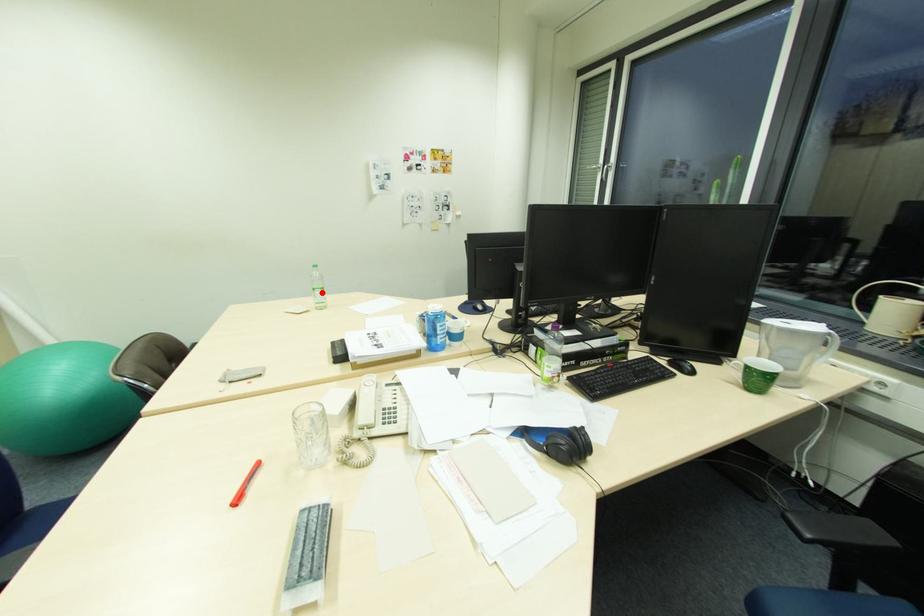
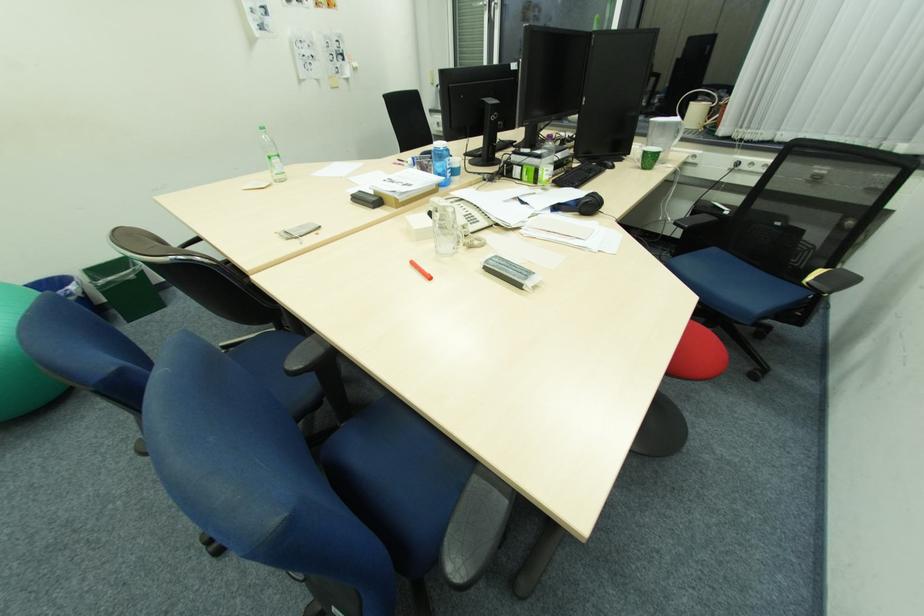
Question: I am providing you with two images of the same scene from different viewpoints. A red point is shown in image1. For the corresponding object point in image2, is it positioned nearer or farther from the camera?

Choices:
 (A) Nearer
 (B) Farther

Answer: (B)